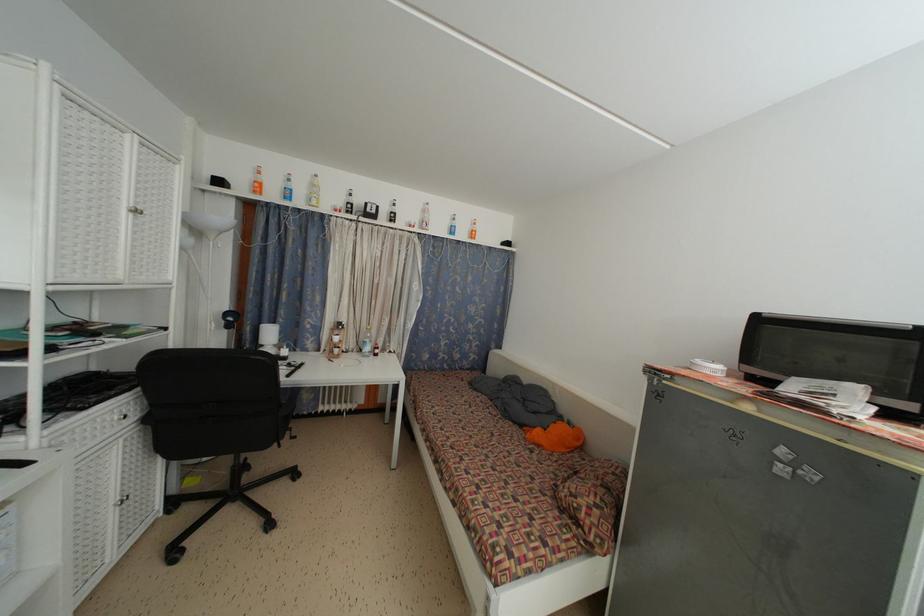
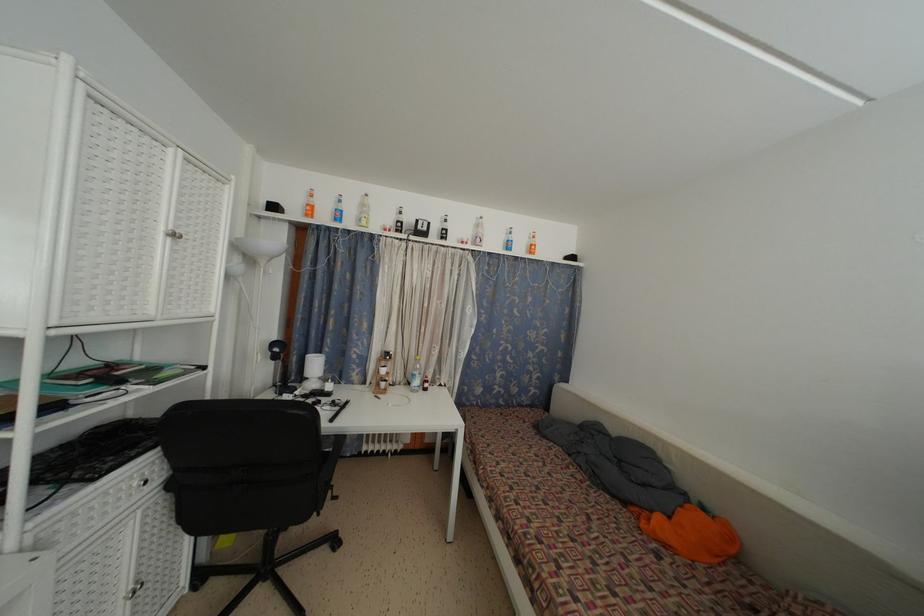
In a continuous first-person perspective shot, in which direction is the camera moving?

The cameraman moved toward left, forward.